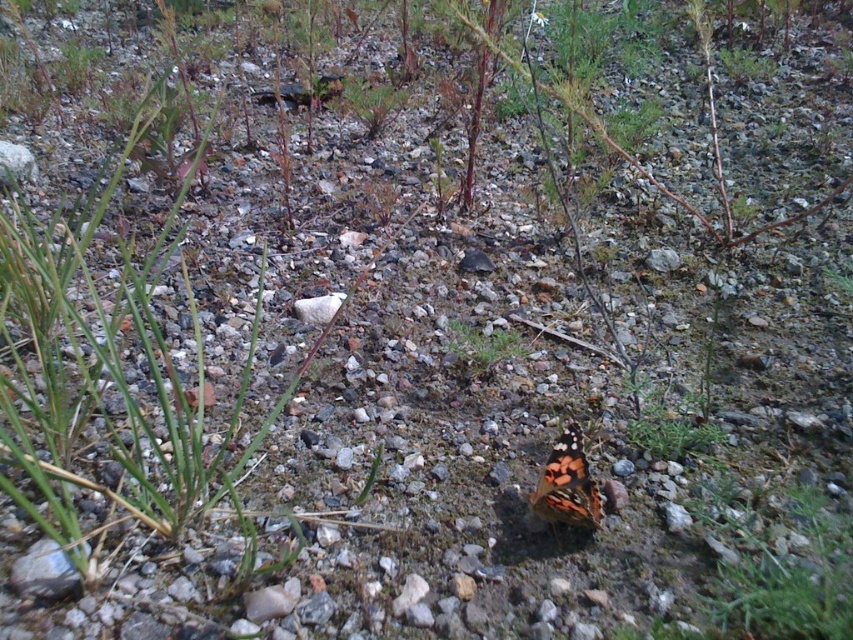
Question: Among these points, which one is nearest to the camera?

Choices:
 (A) (598, 502)
 (B) (497, 365)

Answer: (A)

Question: Which object appears closest to the camera in this image?

Choices:
 (A) multicolored patterned butterfly at center
 (B) green leafy plant at center

Answer: (A)

Question: Is multicolored patterned butterfly at center smaller than green leafy plant at center?

Choices:
 (A) yes
 (B) no

Answer: (B)

Question: Is multicolored patterned butterfly at center wider than green leafy plant at center?

Choices:
 (A) no
 (B) yes

Answer: (A)

Question: Which point appears closest to the camera in this image?

Choices:
 (A) (509, 342)
 (B) (554, 522)

Answer: (B)

Question: Is multicolored patterned butterfly at center positioned behind green leafy plant at center?

Choices:
 (A) yes
 (B) no

Answer: (B)